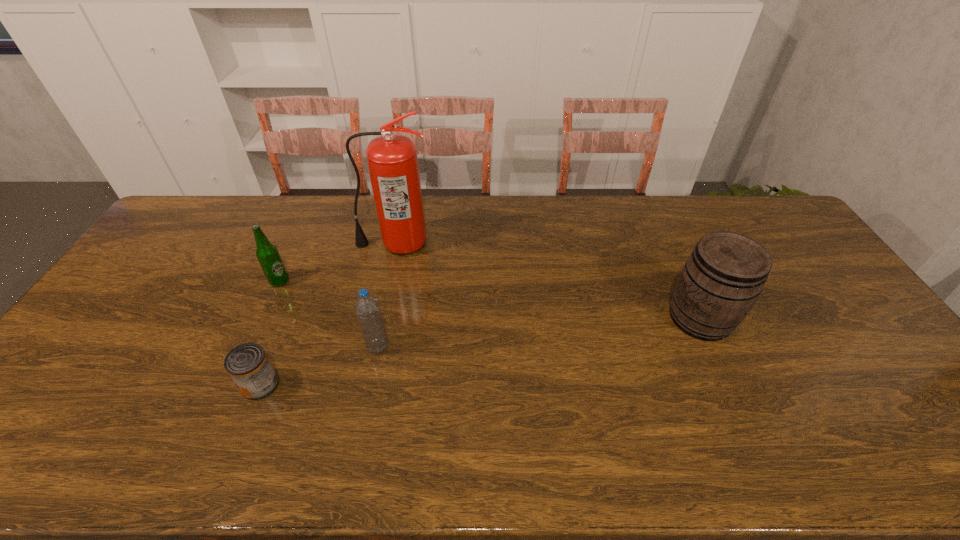
What are the coordinates of `free space between the wine bucket and the water bottle` in the screenshot? It's located at (539, 332).

Locate an element on the screen. Image resolution: width=960 pixels, height=540 pixels. vacant space that is in between the can and the wine bucket is located at coordinates (481, 351).

The height and width of the screenshot is (540, 960). Identify the location of vacant area between the water bottle and the tallest object. (386, 295).

This screenshot has width=960, height=540. I want to click on free space that is in between the beer bottle and the farthest object, so coord(337,262).

The width and height of the screenshot is (960, 540). Find the location of `free space between the wine bucket and the farthest object`. free space between the wine bucket and the farthest object is located at coordinates (547, 281).

Where is `free space between the beer bottle and the water bottle`? free space between the beer bottle and the water bottle is located at coordinates (328, 314).

Find the location of a particular element. The height and width of the screenshot is (540, 960). free spot between the rightmost object and the tallest object is located at coordinates (547, 281).

Where is `the closest object to the nearest object`? This screenshot has width=960, height=540. the closest object to the nearest object is located at coordinates (367, 307).

I want to click on object identified as the closest to the water bottle, so click(x=248, y=365).

What are the coordinates of `free space that satisfies the following two spatial constraints: 1. on the instruction side of the water bottle; 2. on the left side of the farthest object` in the screenshot? It's located at point(373,347).